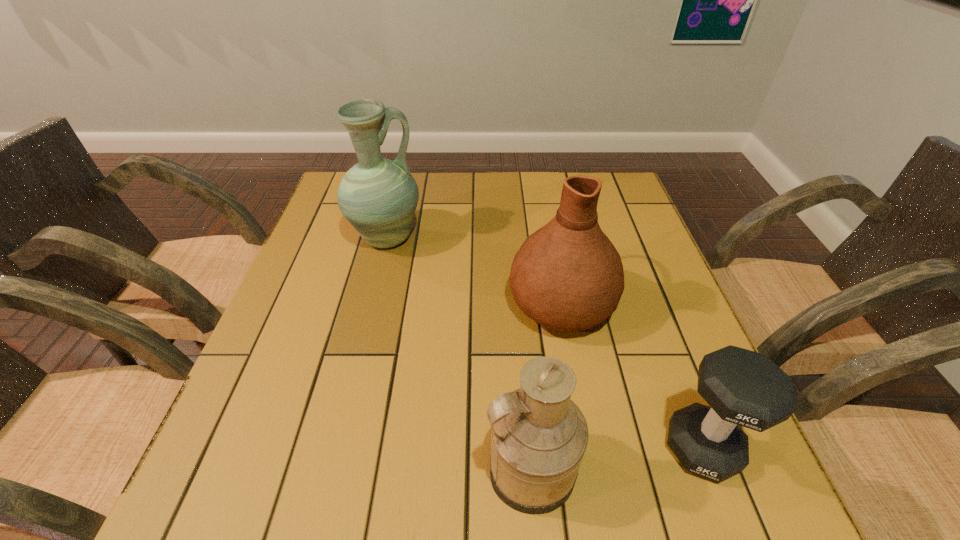
Locate an element on the screen. the farthest object is located at coordinates (378, 196).

This screenshot has width=960, height=540. In order to click on the farthest pitcher in this screenshot , I will do `click(378, 196)`.

You are a GUI agent. You are given a task and a screenshot of the screen. Output one action in this format:
    pyautogui.click(x=<x>, y=<y>)
    Task: Click on the second farthest pitcher
    The image size is (960, 540).
    Given the screenshot: What is the action you would take?
    pyautogui.click(x=568, y=276)

Where is `the nearest pitcher`? This screenshot has height=540, width=960. the nearest pitcher is located at coordinates (539, 436).

Locate an element on the screen. This screenshot has width=960, height=540. the second shortest object is located at coordinates (539, 436).

Locate an element on the screen. The width and height of the screenshot is (960, 540). the shortest object is located at coordinates (746, 388).

Find the location of a particular element. the rightmost object is located at coordinates (746, 388).

The width and height of the screenshot is (960, 540). I want to click on free space located on the handle side of the farthest pitcher, so click(x=480, y=239).

The width and height of the screenshot is (960, 540). I want to click on vacant space located 0.120m on the side of the second farthest object with the handle, so point(548,235).

The height and width of the screenshot is (540, 960). Find the location of `vacant space located on the side of the second farthest object with the handle`. vacant space located on the side of the second farthest object with the handle is located at coordinates (547, 231).